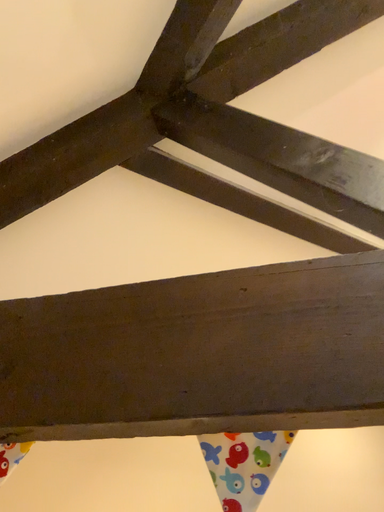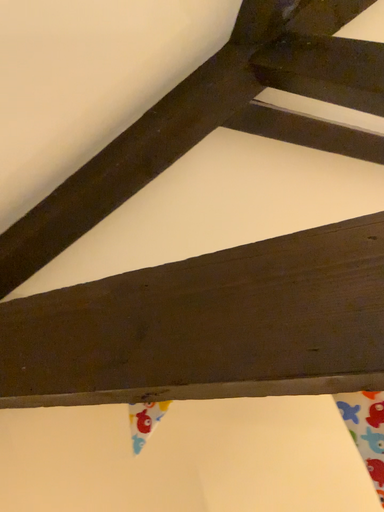
Question: How did the camera likely rotate when shooting the video?

Choices:
 (A) rotated right
 (B) rotated left

Answer: (B)